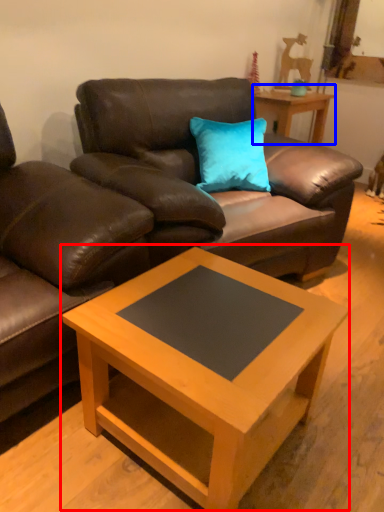
Question: Among these objects, which one is nearest to the camera, coffee table (highlighted by a red box) or table (highlighted by a blue box)?

Choices:
 (A) coffee table
 (B) table

Answer: (A)